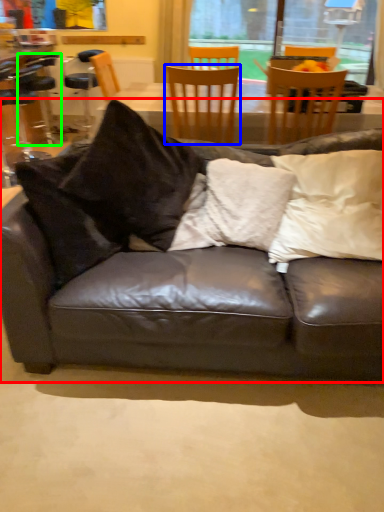
Question: Estimate the real-world distances between objects in this image. Which object is farther from studio couch (highlighted by a red box), chair (highlighted by a blue box) or bar stool (highlighted by a green box)?

Choices:
 (A) chair
 (B) bar stool

Answer: (B)